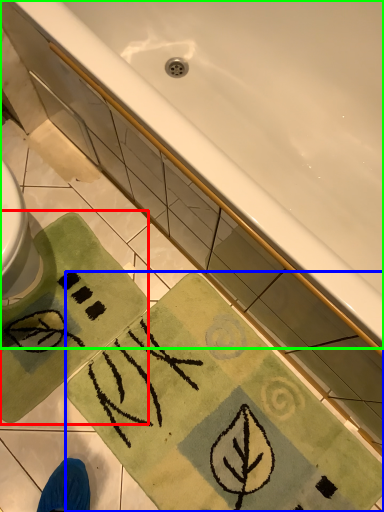
Question: Estimate the real-world distances between objects in this image. Which object is farther from beach towel (highlighted by a red box), beach towel (highlighted by a blue box) or bathtub (highlighted by a green box)?

Choices:
 (A) beach towel
 (B) bathtub

Answer: (B)